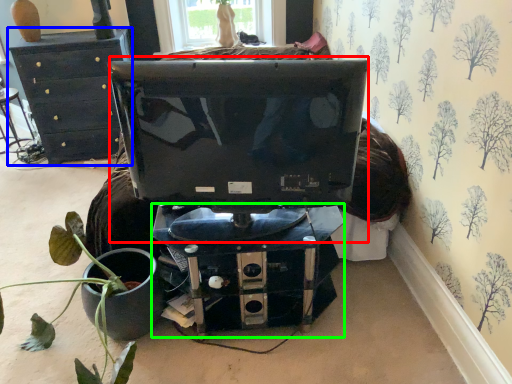
Question: Based on their relative distances, which object is nearer to computer monitor (highlighted by a red box)? Choose from furniture (highlighted by a blue box) and computer desk (highlighted by a green box).

Choices:
 (A) furniture
 (B) computer desk

Answer: (B)